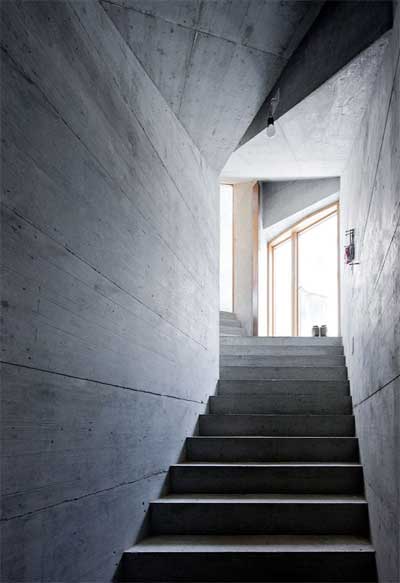
This screenshot has width=400, height=583. I want to click on space between doorway and patio doors, so click(x=242, y=264).